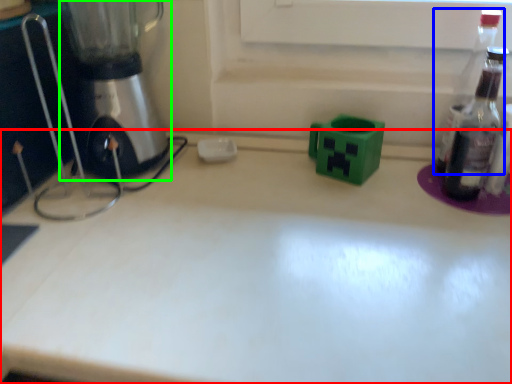
Question: Considering the real-world distances, which object is closest to countertop (highlighted by a red box)? bottle (highlighted by a blue box) or mixer (highlighted by a green box).

Choices:
 (A) bottle
 (B) mixer

Answer: (B)